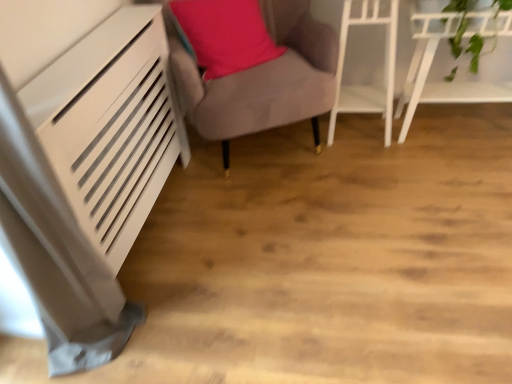
Question: Is white glossy shelf at upper right, which appears as the first furniture when viewed from the right, in contact with white glossy shelf at upper right, the second furniture positioned from the left?

Choices:
 (A) no
 (B) yes

Answer: (A)

Question: Can you confirm if white glossy shelf at upper right, placed as the third furniture when sorted from left to right, is positioned to the left of white glossy shelf at upper right, acting as the second furniture starting from the right?

Choices:
 (A) no
 (B) yes

Answer: (A)

Question: Would you say white glossy shelf at upper right, placed as the third furniture when sorted from left to right, is a long distance from white glossy shelf at upper right, acting as the second furniture starting from the right?

Choices:
 (A) no
 (B) yes

Answer: (A)

Question: Can you confirm if white glossy shelf at upper right, which appears as the first furniture when viewed from the right, is bigger than white glossy shelf at upper right, acting as the second furniture starting from the right?

Choices:
 (A) no
 (B) yes

Answer: (B)

Question: Does white glossy shelf at upper right, placed as the third furniture when sorted from left to right, lie in front of white glossy shelf at upper right, acting as the second furniture starting from the right?

Choices:
 (A) yes
 (B) no

Answer: (A)

Question: Choose the correct answer: Is velvet grey armchair at center, which is counted as the first furniture, starting from the left, inside matte pink pillow at center or outside it?

Choices:
 (A) inside
 (B) outside

Answer: (B)

Question: Based on their positions, is velvet grey armchair at center, which is counted as the first furniture, starting from the left, located to the left or right of matte pink pillow at center?

Choices:
 (A) right
 (B) left

Answer: (A)

Question: Does point (258, 92) appear closer or farther from the camera than point (210, 54)?

Choices:
 (A) farther
 (B) closer

Answer: (B)

Question: In the image, is velvet grey armchair at center, which is counted as the first furniture, starting from the left, positioned in front of or behind matte pink pillow at center?

Choices:
 (A) front
 (B) behind

Answer: (A)

Question: From the image's perspective, is matte pink pillow at center located above or below velvet grey armchair at center, the third furniture in the right-to-left sequence?

Choices:
 (A) above
 (B) below

Answer: (A)

Question: Considering the positions of matte pink pillow at center and velvet grey armchair at center, the third furniture in the right-to-left sequence, in the image, is matte pink pillow at center bigger or smaller than velvet grey armchair at center, the third furniture in the right-to-left sequence,?

Choices:
 (A) big
 (B) small

Answer: (B)

Question: From a real-world perspective, is matte pink pillow at center above or below velvet grey armchair at center, which is counted as the first furniture, starting from the left?

Choices:
 (A) above
 (B) below

Answer: (A)

Question: Does point (220, 36) appear closer or farther from the camera than point (293, 105)?

Choices:
 (A) farther
 (B) closer

Answer: (A)

Question: Considering the positions of velvet grey armchair at center, the third furniture in the right-to-left sequence, and white glossy shelf at upper right, acting as the second furniture starting from the right, in the image, is velvet grey armchair at center, the third furniture in the right-to-left sequence, taller or shorter than white glossy shelf at upper right, acting as the second furniture starting from the right,?

Choices:
 (A) short
 (B) tall

Answer: (B)

Question: Considering their positions, is velvet grey armchair at center, the third furniture in the right-to-left sequence, located in front of or behind white glossy shelf at upper right, acting as the second furniture starting from the right?

Choices:
 (A) front
 (B) behind

Answer: (A)